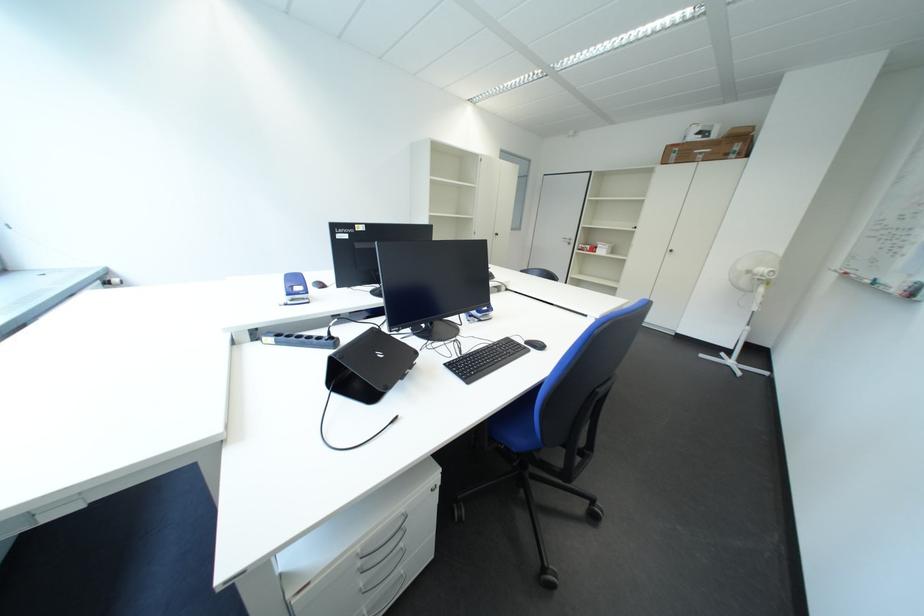
Identify the location of cabinet door handle. The height and width of the screenshot is (616, 924). (670, 249).